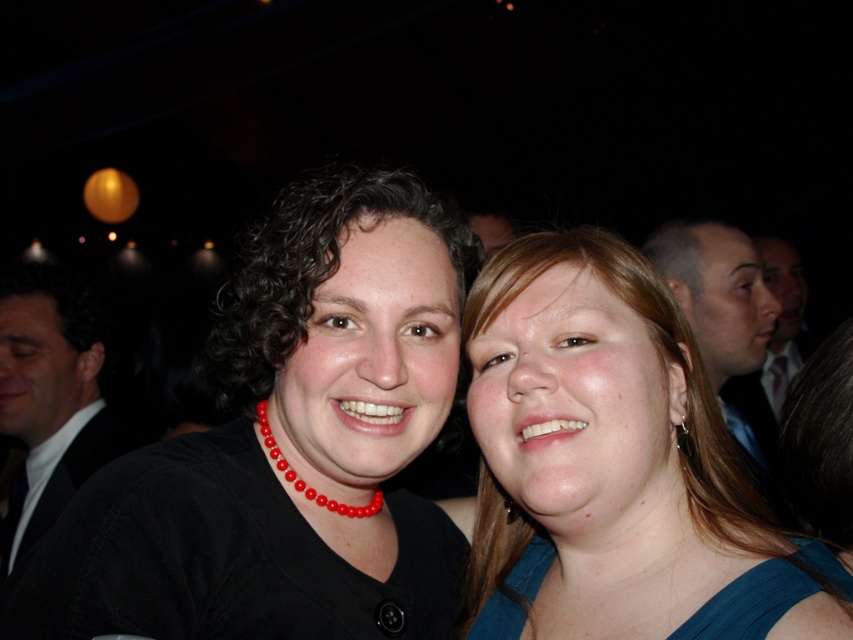
You are a photographer trying to focus on the black matte necklace at upper center and the red beaded necklace at center. Which necklace should you adjust your camera to focus on first if you want to capture both in the same frame?

The black matte necklace at upper center is located above the red beaded necklace at center, so you should focus on the black matte necklace at upper center first to ensure both are in the frame.

You are standing in the center of the room and want to move towards the black suit at left. Which direction should you walk to reach it?

Since the black suit at left is located at coordinates 0.614 on the x axis and 0.063 on the y axis, you should walk to the left to reach it.

You are a photographer at the event and want to ensure that both the black matte necklace at upper center and the black suit at left are clearly visible in the photo. Given their sizes, which one might require more careful focusing to avoid blurring?

The black matte necklace at upper center has a smaller size compared to the black suit at left, so it might require more careful focusing to avoid blurring.